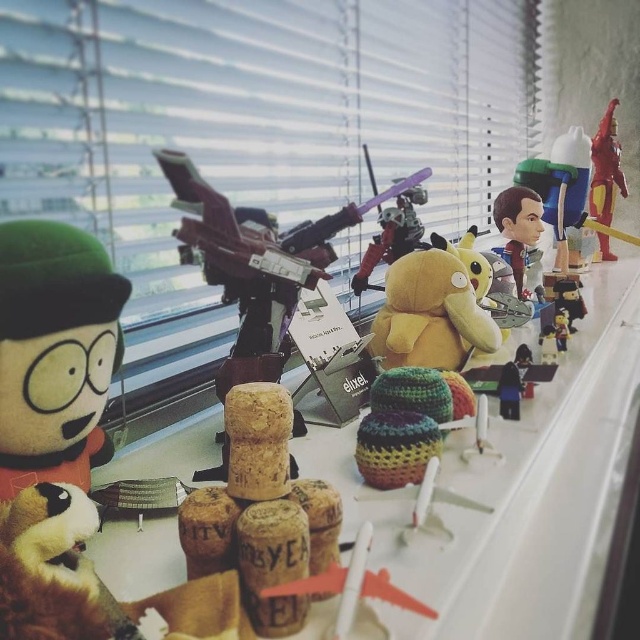
Is cork at center shorter than fluffy green plush at left?

In fact, cork at center may be taller than fluffy green plush at left.

Who is positioned more to the left, cork at center or fluffy green plush at left?

From the viewer's perspective, fluffy green plush at left appears more on the left side.

Does point (216, 330) come behind point (96, 280)?

That is True.

Image resolution: width=640 pixels, height=640 pixels. I want to click on cork at center, so click(x=253, y=124).

Is point (625, 195) farther from viewer compared to point (513, 246)?

Yes, it is.

Can you confirm if metallic red iron man at upper right is thinner than smooth plastic bobblehead at center?

No, metallic red iron man at upper right is not thinner than smooth plastic bobblehead at center.

Is point (620, 182) behind point (509, 234)?

Yes, it is.

Image resolution: width=640 pixels, height=640 pixels. I want to click on metallic red iron man at upper right, so click(x=605, y=168).

Between smooth plastic toy at center and metallic red iron man at upper right, which one appears on the right side from the viewer's perspective?

Positioned to the right is metallic red iron man at upper right.

What do you see at coordinates (561, 186) in the screenshot? I see `smooth plastic toy at center` at bounding box center [561, 186].

Find the location of a particular element. The image size is (640, 640). smooth plastic toy at center is located at coordinates [x=561, y=186].